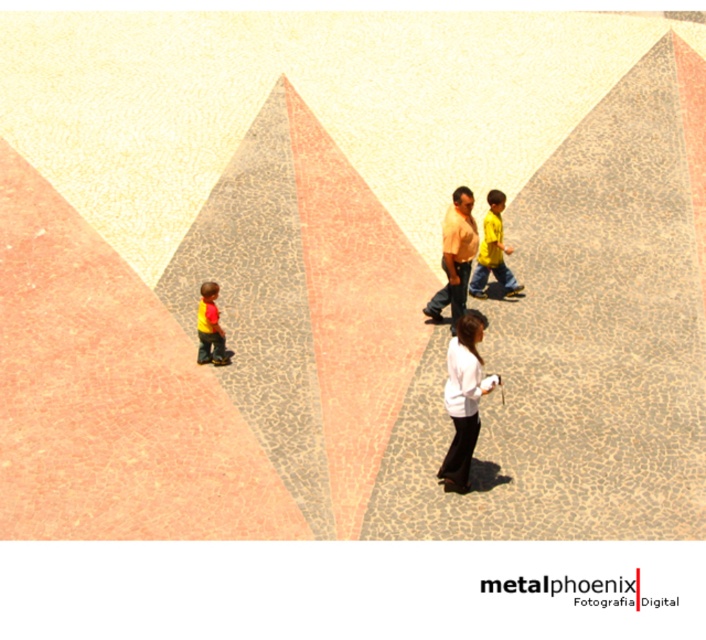
Who is more forward, (x=436, y=320) or (x=498, y=272)?

Point (x=436, y=320) is more forward.

Is point (455, 301) positioned in front of point (481, 275)?

That is True.

Does point (448, 253) come in front of point (513, 278)?

Yes, it is in front of point (513, 278).

Where is `matte pink shirt at center`? This screenshot has height=640, width=706. matte pink shirt at center is located at coordinates [455, 256].

Which is above, white matte shirt at center or yellow fabric shirt at lower left?

yellow fabric shirt at lower left is higher up.

Can you confirm if white matte shirt at center is positioned to the left of yellow fabric shirt at lower left?

Incorrect, white matte shirt at center is not on the left side of yellow fabric shirt at lower left.

Between point (460, 396) and point (201, 301), which one is positioned behind?

The point (201, 301) is behind.

Locate an element on the screen. white matte shirt at center is located at coordinates (462, 400).

Consider the image. Can you confirm if yellow matte shirt at center is positioned to the right of yellow fabric shirt at lower left?

Yes, yellow matte shirt at center is to the right of yellow fabric shirt at lower left.

Can you confirm if yellow matte shirt at center is shorter than yellow fabric shirt at lower left?

In fact, yellow matte shirt at center may be taller than yellow fabric shirt at lower left.

Does point (496, 234) come in front of point (213, 348)?

That is False.

What are the coordinates of `yellow matte shirt at center` in the screenshot? It's located at (491, 252).